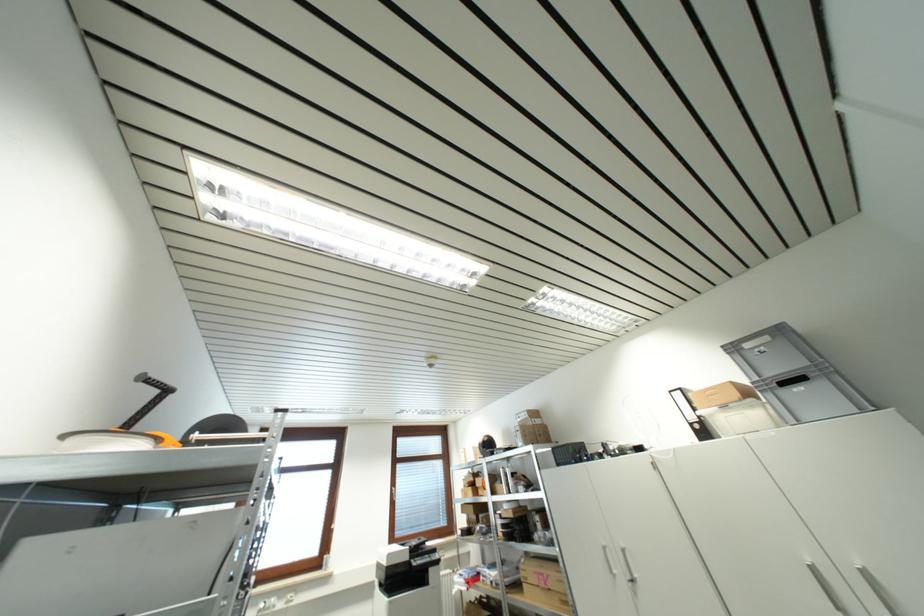
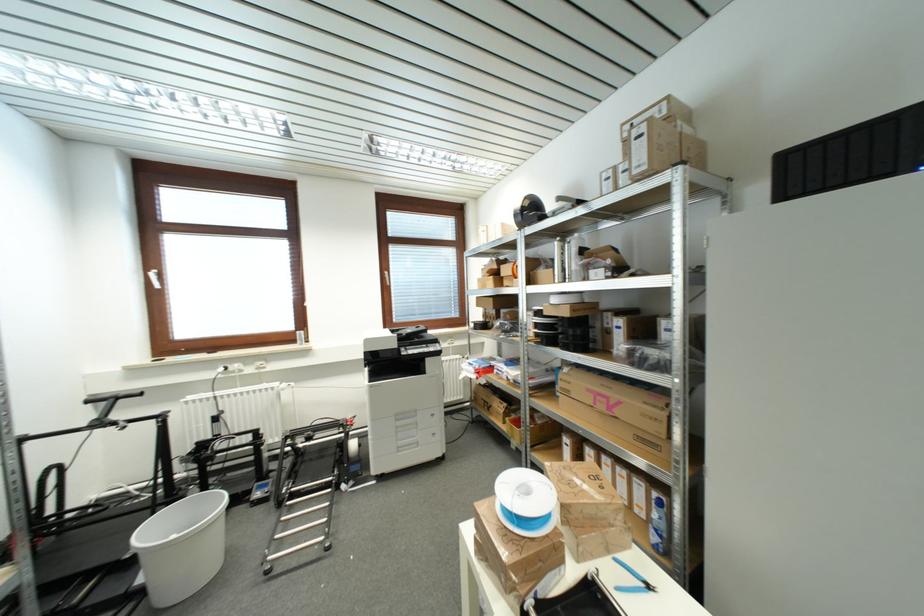
Locate, in the second image, the point that corresponds to the point at 546,586 in the first image.

(605, 408)